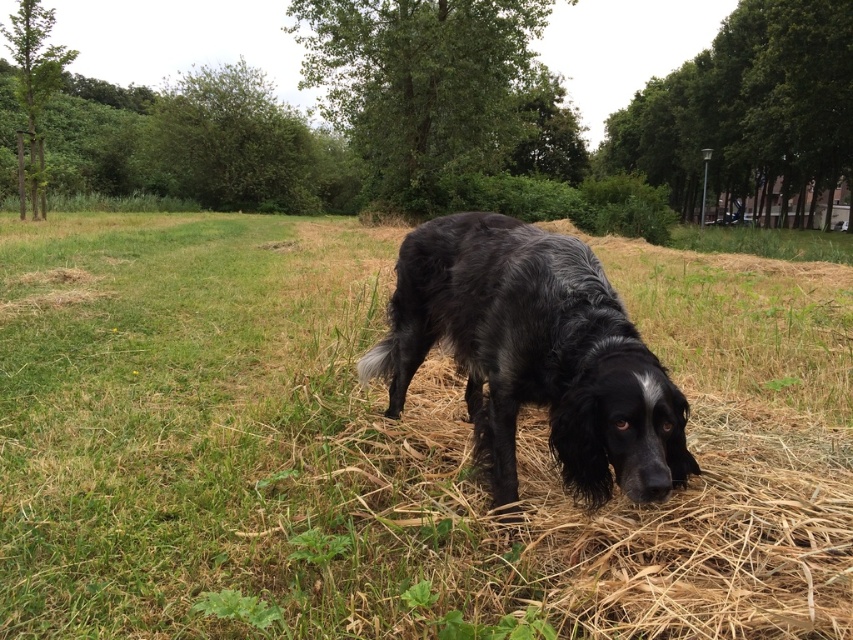
Question: Among these points, which one is farthest from the camera?

Choices:
 (A) (368, 500)
 (B) (572, 440)

Answer: (A)

Question: Does black fur dog at center appear under black shaggy dog at center?

Choices:
 (A) yes
 (B) no

Answer: (B)

Question: Among these points, which one is farthest from the camera?

Choices:
 (A) (602, 282)
 (B) (740, 486)

Answer: (B)

Question: Does black fur dog at center lie behind black shaggy dog at center?

Choices:
 (A) no
 (B) yes

Answer: (A)

Question: Can you confirm if black fur dog at center is positioned to the left of black shaggy dog at center?

Choices:
 (A) no
 (B) yes

Answer: (B)

Question: Which point is farther to the camera?

Choices:
 (A) click(x=497, y=253)
 (B) click(x=805, y=336)

Answer: (B)